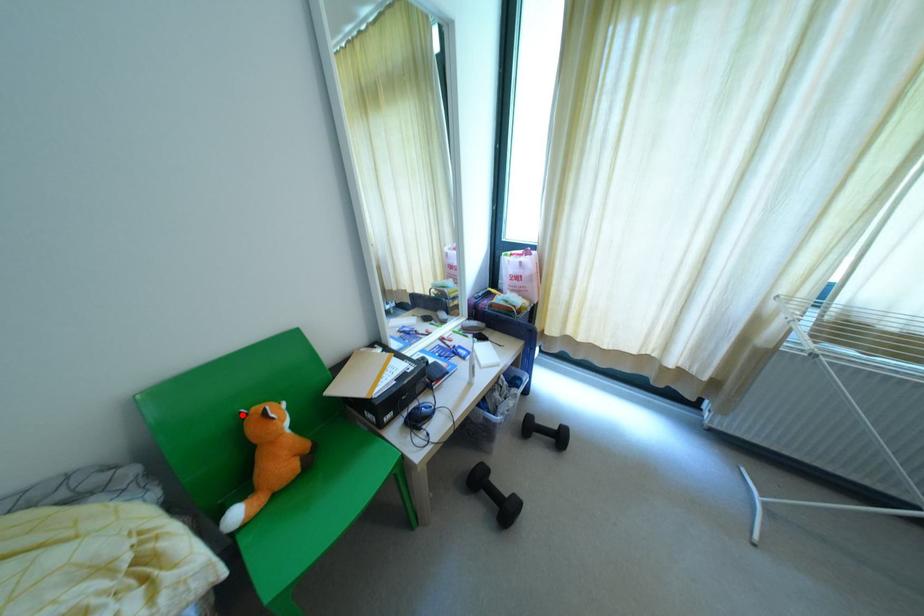
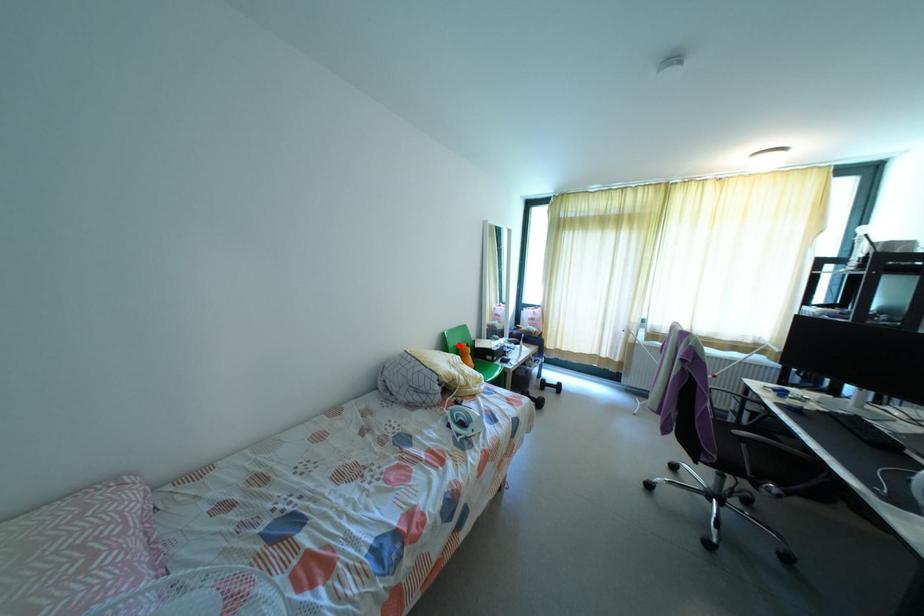
I am providing you with two images of the same scene from different viewpoints. A red point is marked on the first image and another point is marked on the second image. Does the point marked in image1 correspond to the same location as the one in image2?

Yes